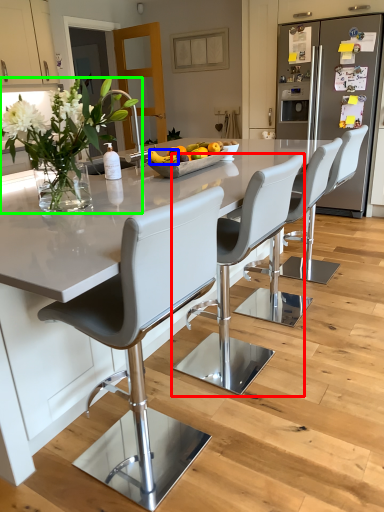
Question: Which is nearer to the chair (highlighted by a red box)? fruit (highlighted by a blue box) or floral arrangement (highlighted by a green box).

Choices:
 (A) fruit
 (B) floral arrangement

Answer: (A)